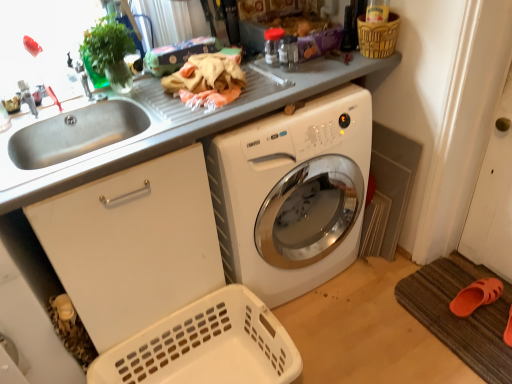
Question: From the image's perspective, relative to brown textured bath mat at lower right, is stainless steel sink at left above or below?

Choices:
 (A) above
 (B) below

Answer: (A)

Question: Looking at their shapes, would you say stainless steel sink at left is wider or thinner than brown textured bath mat at lower right?

Choices:
 (A) wide
 (B) thin

Answer: (B)

Question: Which of these objects is positioned closest to the brown woven basket at upper right, the 2th basket from the left?

Choices:
 (A) white glossy washing machine at center
 (B) brown textured bath mat at lower right
 (C) brushed metal faucet at upper left
 (D) white plastic basket at lower left, the 1th basket ordered from the bottom
 (E) stainless steel sink at left

Answer: (A)

Question: Considering the real-world distances, which object is farthest from the brushed metal faucet at upper left?

Choices:
 (A) brown textured bath mat at lower right
 (B) stainless steel sink at left
 (C) white glossy washing machine at center
 (D) white plastic basket at lower left, the 1th basket ordered from the bottom
 (E) brown woven basket at upper right, which is counted as the 1th basket, starting from the right

Answer: (A)